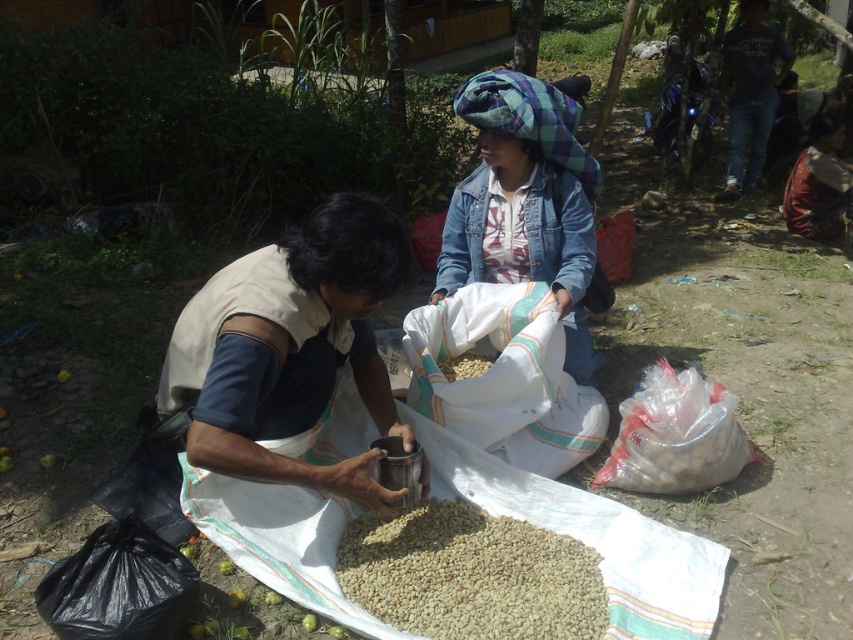
Identify the location of metallic cup at center. (289, 348).

Is metallic cup at center to the right of dark blue t-shirt at upper right from the viewer's perspective?

No, metallic cup at center is not to the right of dark blue t-shirt at upper right.

Locate an element on the screen. This screenshot has width=853, height=640. metallic cup at center is located at coordinates (289, 348).

Identify the location of metallic cup at center. (289, 348).

Looking at this image, is metallic cup at center smaller than light brown grain at center?

No, metallic cup at center is not smaller than light brown grain at center.

Who is positioned more to the right, metallic cup at center or light brown grain at center?

From the viewer's perspective, light brown grain at center appears more on the right side.

Is point (369, 493) more distant than point (387, 580)?

No, it is not.

Where is `metallic cup at center`? Image resolution: width=853 pixels, height=640 pixels. metallic cup at center is located at coordinates (289, 348).

Can you confirm if denim jacket at center is positioned to the left of dark blue t-shirt at upper right?

Indeed, denim jacket at center is positioned on the left side of dark blue t-shirt at upper right.

Does denim jacket at center come behind dark blue t-shirt at upper right?

No, it is in front of dark blue t-shirt at upper right.

Is point (508, 77) farther from camera compared to point (722, 195)?

No.

In order to click on denim jacket at center in this screenshot , I will do `click(524, 202)`.